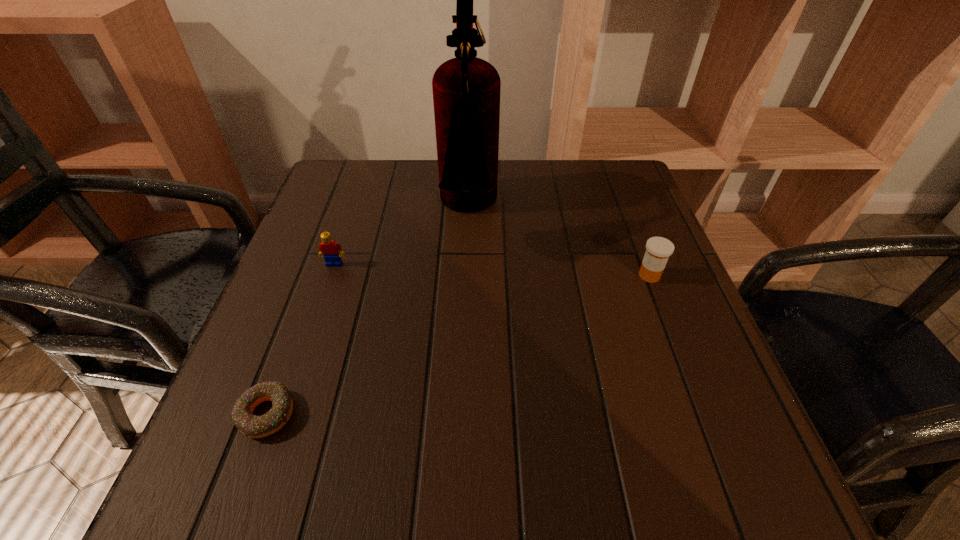
Where is `vacant space positioned 0.340m on the label of the rightmost object`? This screenshot has height=540, width=960. vacant space positioned 0.340m on the label of the rightmost object is located at coordinates (472, 275).

The height and width of the screenshot is (540, 960). I want to click on vacant area situated 0.300m on the back of the shortest object, so click(x=322, y=264).

Find the location of a particular element. object located at the far edge is located at coordinates (466, 90).

Locate an element on the screen. Lego that is at the left edge is located at coordinates (328, 248).

Where is `doughnut that is at the left edge`? The width and height of the screenshot is (960, 540). doughnut that is at the left edge is located at coordinates (253, 426).

Locate an element on the screen. The width and height of the screenshot is (960, 540). object located in the right edge section of the desktop is located at coordinates (658, 249).

In the image, there is a desktop. Where is `vacant space at the far edge`? The width and height of the screenshot is (960, 540). vacant space at the far edge is located at coordinates click(x=504, y=199).

At what (x,y) coordinates should I click in order to perform the action: click on vacant space at the near edge of the desktop. Please return your answer as a coordinate pair (x, y). The height and width of the screenshot is (540, 960). Looking at the image, I should click on [623, 479].

Find the location of `vacant space at the left edge of the desktop`. vacant space at the left edge of the desktop is located at coordinates (288, 269).

I want to click on vacant space at the right edge of the desktop, so 667,359.